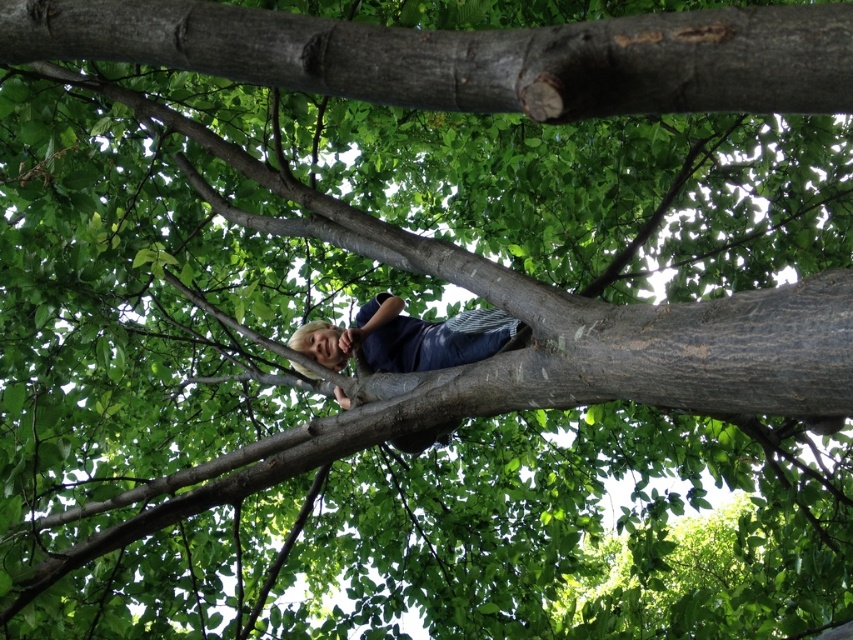
Can you confirm if smooth gray tree trunk at upper center is bigger than blonde hair at center?

No.

Which is more to the right, smooth gray tree trunk at upper center or blonde hair at center?

Positioned to the right is blonde hair at center.

Does point (488, 99) come behind point (415, 438)?

No.

The height and width of the screenshot is (640, 853). What are the coordinates of `smooth gray tree trunk at upper center` in the screenshot? It's located at (469, 56).